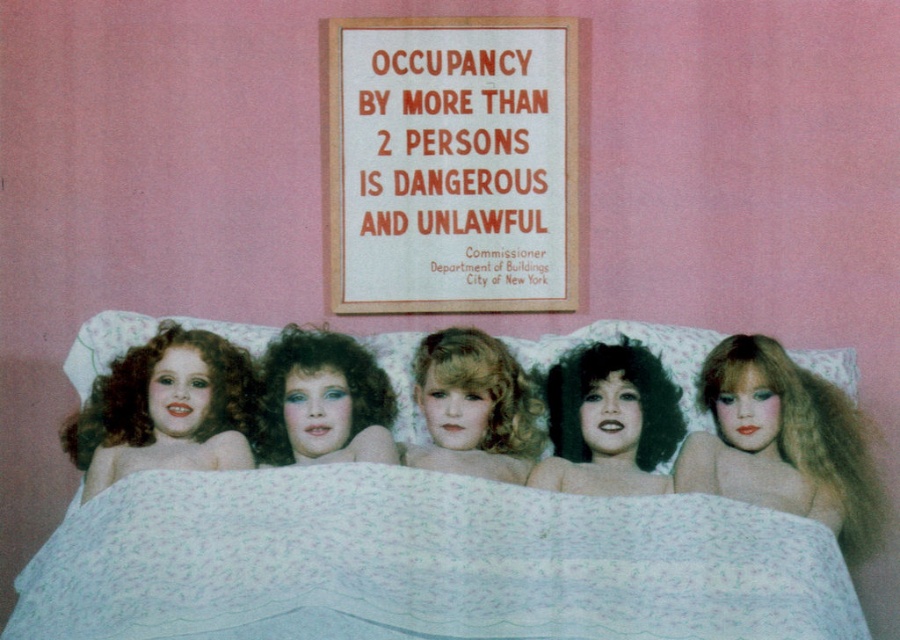
You are a delivery person who needs to place a rectangular box that is 36 inches long between the white paper sign at upper center and the blonde hair doll at center. Can you fit the box horizontally between them without tilting it?

The distance between the white paper sign at upper center and the blonde hair doll at center is 35.45 inches. Since the box is 36 inches long, it cannot fit horizontally between them without tilting.